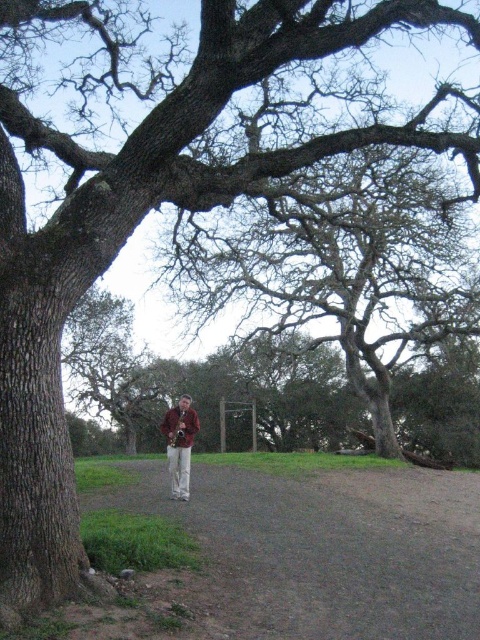
You are standing at the bottom of the image and want to walk to the large leafless tree on the left. Which direction should you move relative to the brown gravel path at center?

Move to the left relative to the brown gravel path at center because the large leafless tree is on the left side of the image.

You are a photographer trying to capture the brown leather jacket at center and the brown gravel path at center in the same frame. If your camera has a focal length of 50mm, will you be able to include both objects in the shot without moving your position?

The distance between the brown gravel path at center and the brown leather jacket at center is 2.56 meters. With a 50mm focal length, which is considered a standard lens providing a field of view similar to human vision, it is likely possible to capture both objects in the same frame without moving, as the distance between them is within the typical depth of field and field of view for such a lens.

You are a photographer aiming to capture the brown leather jacket at center and the brown gravel path at center in a single shot. Since both are brown, how can you ensure the jacket stands out more in the photo?

The brown gravel path at center is in front of the brown leather jacket at center. To make the jacket stand out, focus on the jacket and let the path blur slightly in the background, using depth of field to create separation between the two brown elements.